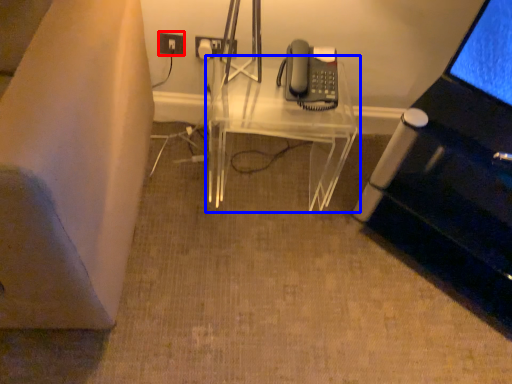
Question: Which object appears farthest to the camera in this image, electric outlet (highlighted by a red box) or table (highlighted by a blue box)?

Choices:
 (A) electric outlet
 (B) table

Answer: (A)